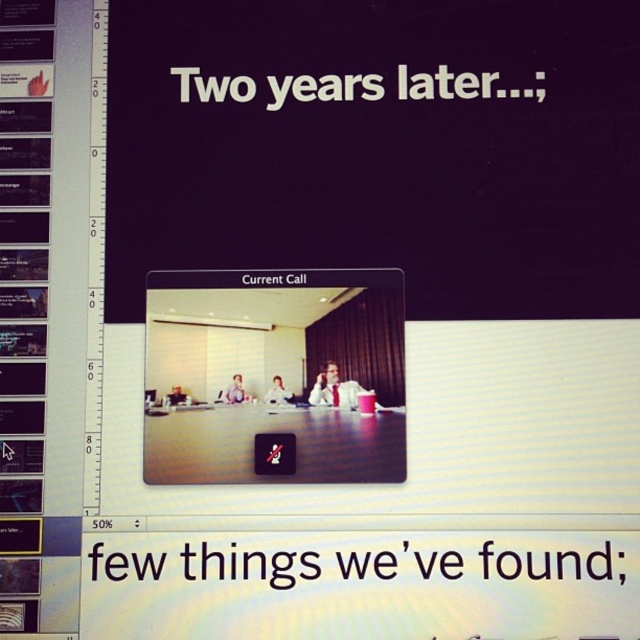
Which is more to the left, matte black screen at center or black plastic text at center?

matte black screen at center

Does matte black screen at center have a greater width compared to black plastic text at center?

In fact, matte black screen at center might be narrower than black plastic text at center.

The image size is (640, 640). What do you see at coordinates (273, 376) in the screenshot? I see `matte black screen at center` at bounding box center [273, 376].

Find the location of `matte black screen at center`. matte black screen at center is located at coordinates (273, 376).